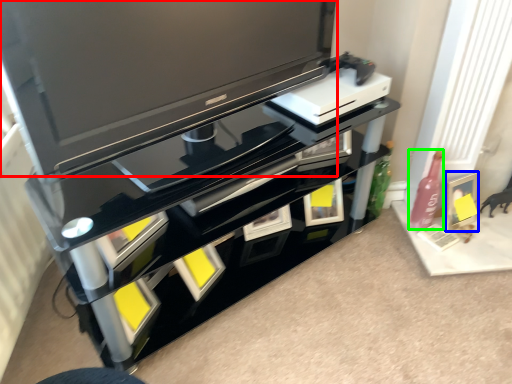
Question: Considering the real-world distances, which object is farthest from television (highlighted by a red box)? picture frame (highlighted by a blue box) or bottle (highlighted by a green box)?

Choices:
 (A) picture frame
 (B) bottle

Answer: (A)